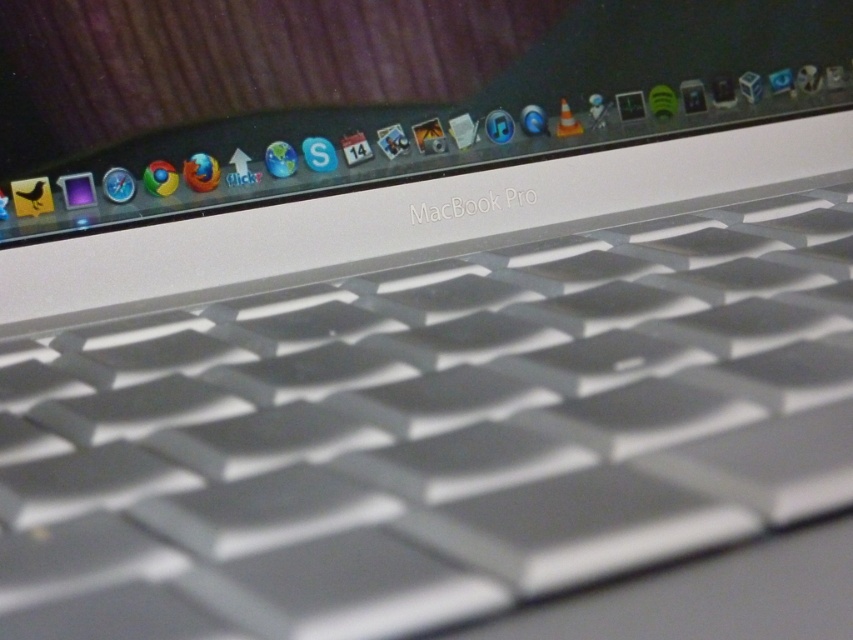
You are trying to locate the satin silver keyboard at center on the MacBook Pro laptop. According to the coordinates provided, where is the point (430, 432) located?

The point (430, 432) corresponds to the satin silver keyboard at center.

You are trying to place a protective cover over the satin silver keyboard at center and the satin silver macbook pro at upper center. Based on their sizes, which one requires a larger cover?

The satin silver macbook pro at upper center requires a larger cover because it has a greater width than the satin silver keyboard at center.

You are setting up a workspace and want to place a small plant between the satin silver keyboard at center and the satin silver macbook pro at upper center. Based on their sizes, which object should the plant be closer to?

The satin silver keyboard at center is smaller than the satin silver macbook pro at upper center, so the plant should be placed closer to the larger MacBook Pro to maintain balance in the workspace layout.